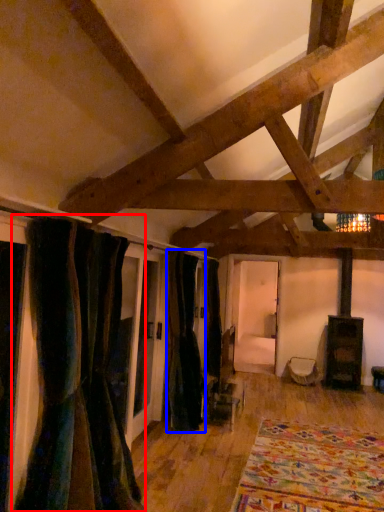
Question: Which object appears closest to the camera in this image, curtain (highlighted by a red box) or curtain (highlighted by a blue box)?

Choices:
 (A) curtain
 (B) curtain

Answer: (A)